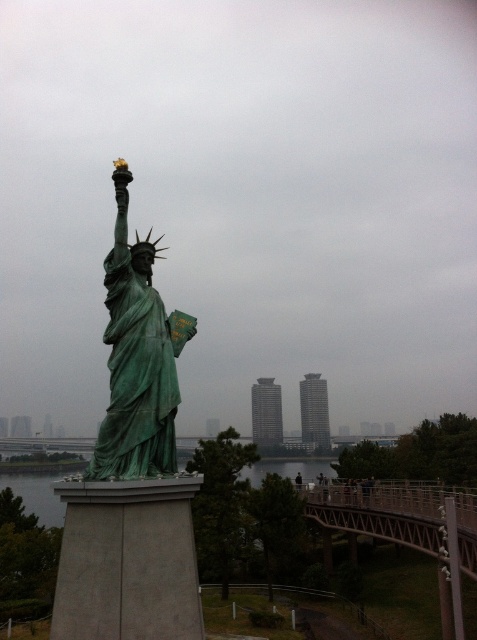
Can you confirm if green patina statue at center is positioned to the right of green patina water at lower left?

Yes, green patina statue at center is to the right of green patina water at lower left.

Measure the distance between green patina statue at center and green patina water at lower left.

The distance of green patina statue at center from green patina water at lower left is 55.07 feet.

You are a GUI agent. You are given a task and a screenshot of the screen. Output one action in this format:
    pyautogui.click(x=<x>, y=<y>)
    Task: Click on the green patina statue at center
    The width and height of the screenshot is (477, 640).
    Given the screenshot: What is the action you would take?
    pyautogui.click(x=135, y=360)